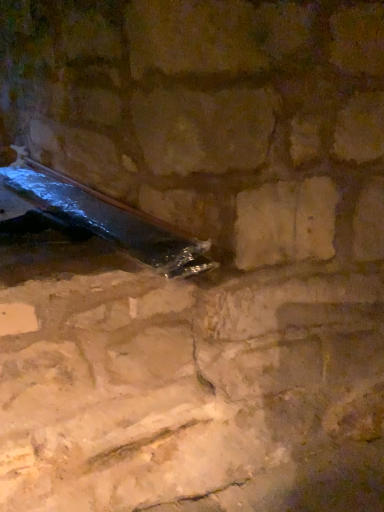
The image size is (384, 512). What do you see at coordinates (106, 219) in the screenshot? I see `metallic reflective at left` at bounding box center [106, 219].

I want to click on metallic reflective at left, so click(x=106, y=219).

This screenshot has width=384, height=512. Find the location of `metallic reflective at left`. metallic reflective at left is located at coordinates (106, 219).